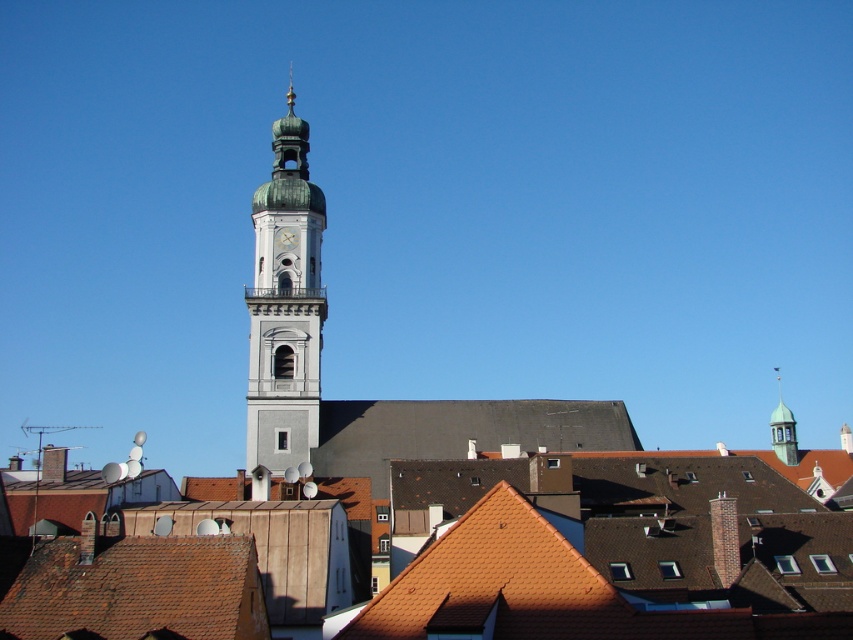
Question: Considering the relative positions of green polished dome at center and green copper bell tower at upper right in the image provided, where is green polished dome at center located with respect to green copper bell tower at upper right?

Choices:
 (A) left
 (B) right

Answer: (A)

Question: Is green polished dome at center positioned behind white glossy clock at center?

Choices:
 (A) yes
 (B) no

Answer: (B)

Question: Among these objects, which one is nearest to the camera?

Choices:
 (A) green copper bell tower at upper right
 (B) white glossy clock at center
 (C) green polished dome at center

Answer: (C)

Question: Which point is closer to the camera taking this photo?

Choices:
 (A) (300, 195)
 (B) (281, 244)
 (C) (788, 456)

Answer: (B)

Question: Which point is closer to the camera taking this photo?

Choices:
 (A) (788, 445)
 (B) (282, 323)
 (C) (276, 232)

Answer: (B)

Question: Does green polished dome at center lie behind green copper bell tower at upper right?

Choices:
 (A) yes
 (B) no

Answer: (B)